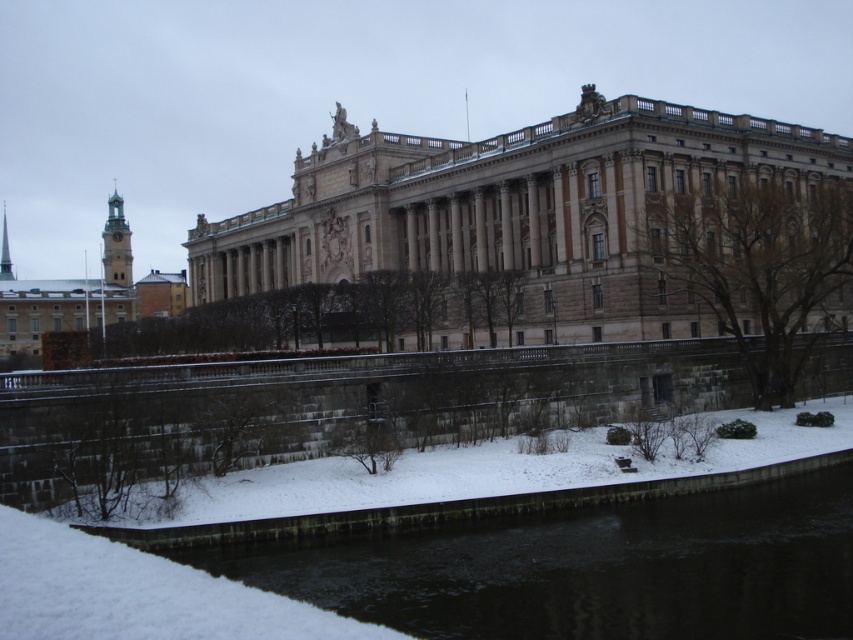
Identify the location of beige stone palace at center. tap(514, 209).

Is point (410, 172) in front of point (86, 321)?

Yes.

The height and width of the screenshot is (640, 853). I want to click on beige stone palace at center, so click(514, 209).

Find the location of a particular element. This screenshot has height=640, width=853. beige stone palace at center is located at coordinates (514, 209).

Who is higher up, beige stone palace at center or black ice at lower left?

beige stone palace at center is higher up.

Can you confirm if beige stone palace at center is shorter than black ice at lower left?

Incorrect, beige stone palace at center's height does not fall short of black ice at lower left's.

Where is `beige stone palace at center`? Image resolution: width=853 pixels, height=640 pixels. beige stone palace at center is located at coordinates (514, 209).

Based on the photo, can you confirm if black ice at lower left is shorter than golden stone tower at left?

Correct, black ice at lower left is not as tall as golden stone tower at left.

Is point (576, 588) closer to camera compared to point (71, 301)?

Yes, it is.

Measure the distance between point (399, 532) and camera.

A distance of 49.64 meters exists between point (399, 532) and camera.

The height and width of the screenshot is (640, 853). What are the coordinates of `black ice at lower left` in the screenshot? It's located at (584, 566).